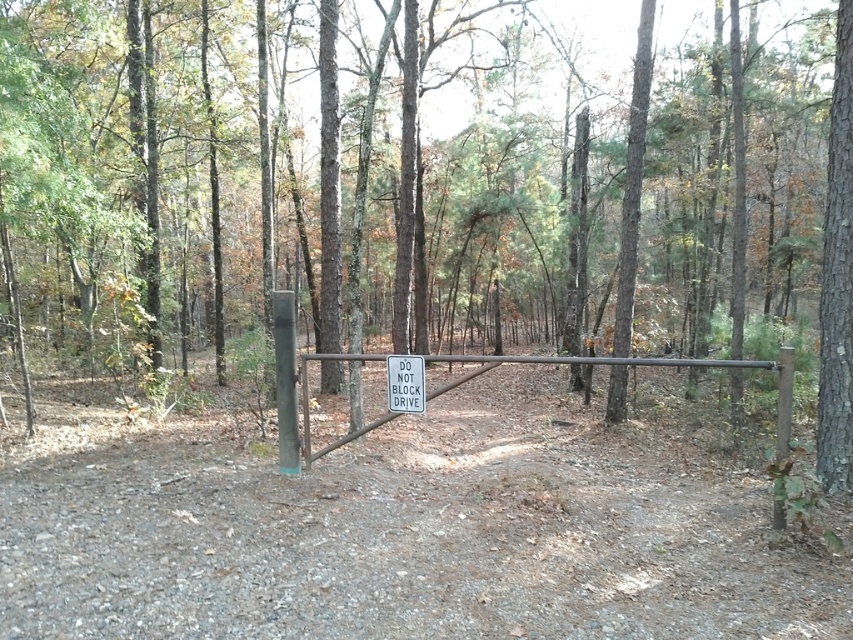
How far apart are smooth bark tree at right and brown wooden gate at center?

The distance of smooth bark tree at right from brown wooden gate at center is 3.12 meters.

Can you confirm if smooth bark tree at right is positioned to the left of brown wooden gate at center?

No, smooth bark tree at right is not to the left of brown wooden gate at center.

Locate an element on the screen. This screenshot has height=640, width=853. smooth bark tree at right is located at coordinates (837, 276).

Is smooth bark tree at right above white plastic sign at center?

Indeed, smooth bark tree at right is positioned over white plastic sign at center.

Can you confirm if smooth bark tree at right is wider than white plastic sign at center?

Yes.

Which is behind, point (822, 252) or point (399, 384)?

The point (822, 252) is behind.

The height and width of the screenshot is (640, 853). In order to click on smooth bark tree at right in this screenshot , I will do `click(837, 276)`.

Does brown wooden gate at center have a smaller size compared to white plastic sign at center?

Incorrect, brown wooden gate at center is not smaller in size than white plastic sign at center.

Can you confirm if brown wooden gate at center is positioned above white plastic sign at center?

No, brown wooden gate at center is not above white plastic sign at center.

Locate an element on the screen. The width and height of the screenshot is (853, 640). brown wooden gate at center is located at coordinates (302, 388).

Where is `brown wooden gate at center`? Image resolution: width=853 pixels, height=640 pixels. brown wooden gate at center is located at coordinates (302, 388).